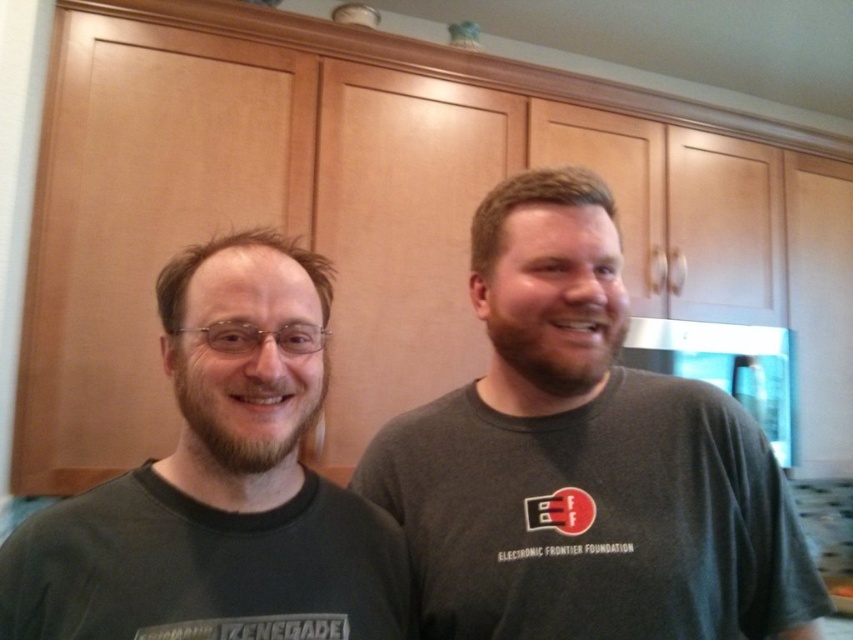
Question: Is dark gray t-shirt at right further to the viewer compared to dark gray t-shirt at left?

Choices:
 (A) no
 (B) yes

Answer: (B)

Question: Which point is farther from the camera taking this photo?

Choices:
 (A) (502, 221)
 (B) (36, 630)

Answer: (A)

Question: From the image, what is the correct spatial relationship of dark gray t-shirt at right in relation to dark gray t-shirt at left?

Choices:
 (A) right
 (B) left

Answer: (A)

Question: Which point is closer to the camera?

Choices:
 (A) (195, 445)
 (B) (561, 321)

Answer: (A)

Question: Is dark gray t-shirt at right positioned in front of dark gray t-shirt at left?

Choices:
 (A) yes
 (B) no

Answer: (B)